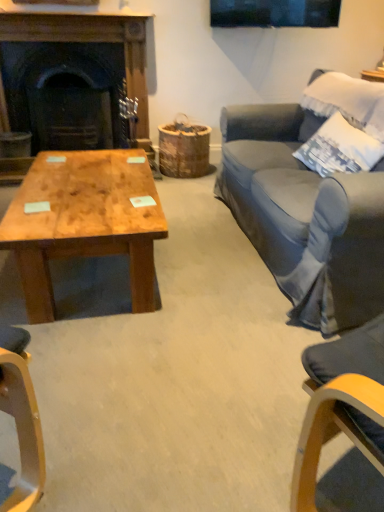
The image size is (384, 512). I want to click on natural wood coffee table at lower left, so click(x=84, y=222).

This screenshot has height=512, width=384. Describe the element at coordinates (339, 148) in the screenshot. I see `white cotton pillow at upper right` at that location.

Identify the location of dark wood fireplace at left. (72, 78).

Identify the location of natural wood coffee table at lower left. (84, 222).

Between dark wood fireplace at left and white cotton pillow at upper right, which one has larger width?

dark wood fireplace at left is wider.

Would you say white cotton pillow at upper right is part of dark wood fireplace at left's contents?

No, white cotton pillow at upper right is not inside dark wood fireplace at left.

Find the location of a particular element. pillow lying on the right of dark wood fireplace at left is located at coordinates (339, 148).

Which of these two, dark wood fireplace at left or white cotton pillow at upper right, is bigger?

With larger size is dark wood fireplace at left.

Who is taller, natural wood coffee table at lower left or white cotton pillow at upper right?

Standing taller between the two is white cotton pillow at upper right.

Is natural wood coffee table at lower left oriented away from white cotton pillow at upper right?

That's not correct — natural wood coffee table at lower left is not looking away from white cotton pillow at upper right.

From a real-world perspective, relative to white cotton pillow at upper right, is natural wood coffee table at lower left vertically above or below?

Clearly, from a real-world perspective, natural wood coffee table at lower left is below white cotton pillow at upper right.

Does natural wood coffee table at lower left have a smaller size compared to white cotton pillow at upper right?

No.

Is dark wood fireplace at left bigger than natural wood coffee table at lower left?

Yes.

Which of these two, dark wood fireplace at left or natural wood coffee table at lower left, is wider?

natural wood coffee table at lower left.

Does point (96, 35) come behind point (15, 232)?

That is True.

Is dark wood fireplace at left located outside natural wood coffee table at lower left?

Absolutely, dark wood fireplace at left is external to natural wood coffee table at lower left.

Considering the points (364, 143) and (82, 106), which point is behind, point (364, 143) or point (82, 106)?

The point (82, 106) is behind.

Does white cotton pillow at upper right contain dark wood fireplace at left?

No, dark wood fireplace at left is not a part of white cotton pillow at upper right.

Is white cotton pillow at upper right turned away from dark wood fireplace at left?

white cotton pillow at upper right does not have its back to dark wood fireplace at left.

From the picture: From a real-world perspective, which is physically below, white cotton pillow at upper right or natural wood coffee table at lower left?

natural wood coffee table at lower left, from a real-world perspective.

Is white cotton pillow at upper right in contact with natural wood coffee table at lower left?

white cotton pillow at upper right and natural wood coffee table at lower left are clearly separated.

Which object is positioned more to the right, white cotton pillow at upper right or natural wood coffee table at lower left?

Positioned to the right is white cotton pillow at upper right.

Does white cotton pillow at upper right contain natural wood coffee table at lower left?

Definitely not — natural wood coffee table at lower left is not inside white cotton pillow at upper right.

From the image's perspective, is natural wood coffee table at lower left over dark wood fireplace at left?

No, from the image's perspective, natural wood coffee table at lower left is not over dark wood fireplace at left.

Between natural wood coffee table at lower left and dark wood fireplace at left, which one is positioned behind?

dark wood fireplace at left is more distant.

Based on their sizes in the image, would you say natural wood coffee table at lower left is bigger or smaller than dark wood fireplace at left?

natural wood coffee table at lower left is smaller than dark wood fireplace at left.

Between natural wood coffee table at lower left and dark wood fireplace at left, which one has larger width?

natural wood coffee table at lower left.

The width and height of the screenshot is (384, 512). I want to click on pillow in front of the dark wood fireplace at left, so click(x=339, y=148).

At what (x,y) coordinates should I click in order to perform the action: click on pillow lying above the natural wood coffee table at lower left (from the image's perspective). Please return your answer as a coordinate pair (x, y). The height and width of the screenshot is (512, 384). Looking at the image, I should click on (339, 148).

From the image, which object appears to be nearer to dark wood fireplace at left, natural wood coffee table at lower left or white cotton pillow at upper right?

natural wood coffee table at lower left is positioned closer to the anchor dark wood fireplace at left.

Estimate the real-world distances between objects in this image. Which object is further from natural wood coffee table at lower left, white cotton pillow at upper right or dark wood fireplace at left?

The object further to natural wood coffee table at lower left is dark wood fireplace at left.

Looking at the image, which one is located further to white cotton pillow at upper right, dark wood fireplace at left or natural wood coffee table at lower left?

Among the two, dark wood fireplace at left is located further to white cotton pillow at upper right.

Looking at the image, which one is located further to white cotton pillow at upper right, natural wood coffee table at lower left or dark wood fireplace at left?

dark wood fireplace at left lies further to white cotton pillow at upper right than the other object.

Considering their positions, is dark wood fireplace at left positioned closer to natural wood coffee table at lower left than white cotton pillow at upper right?

Based on the image, white cotton pillow at upper right appears to be nearer to natural wood coffee table at lower left.

In the scene shown: When comparing their distances from dark wood fireplace at left, does white cotton pillow at upper right or natural wood coffee table at lower left seem further?

Among the two, white cotton pillow at upper right is located further to dark wood fireplace at left.

Where is `coffee table between dark wood fireplace at left and white cotton pillow at upper right`? The image size is (384, 512). coffee table between dark wood fireplace at left and white cotton pillow at upper right is located at coordinates (84, 222).